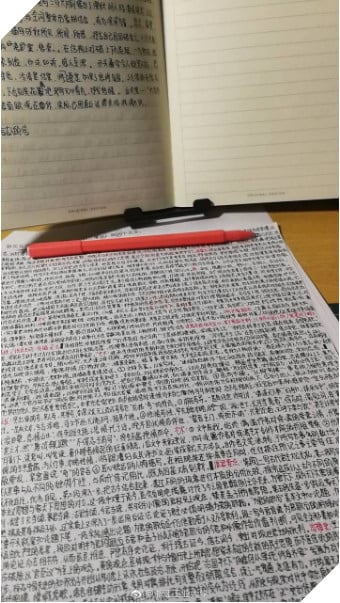
Locate an element on the screen. This screenshot has height=603, width=340. desk is located at coordinates (310, 257).